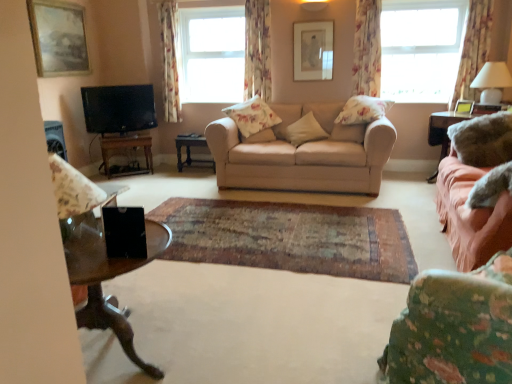
Identify the location of spots to the right of transparent glass coffee table at lower left. The width and height of the screenshot is (512, 384). (245, 332).